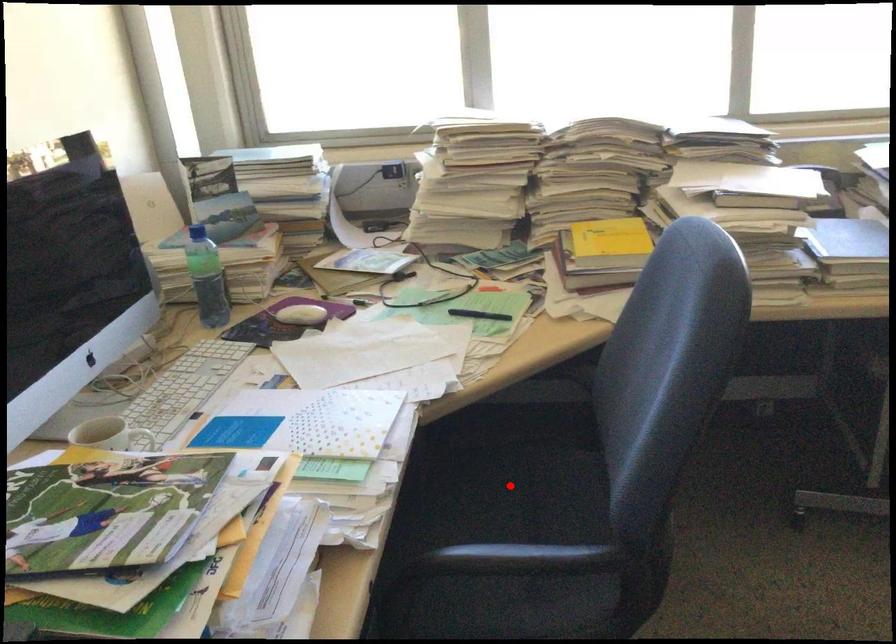
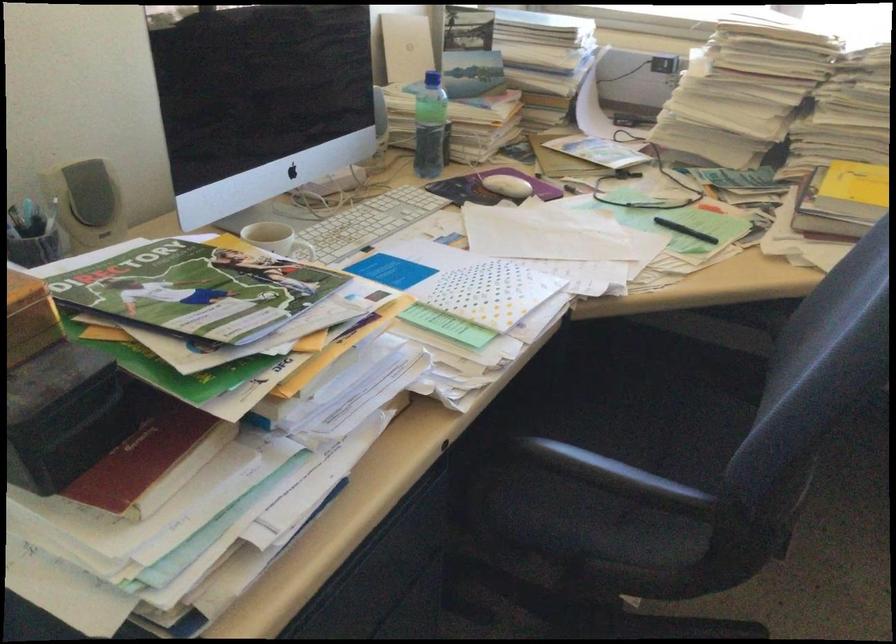
Where in the second image is the point corresponding to the highlighted location from the first image?

(653, 411)